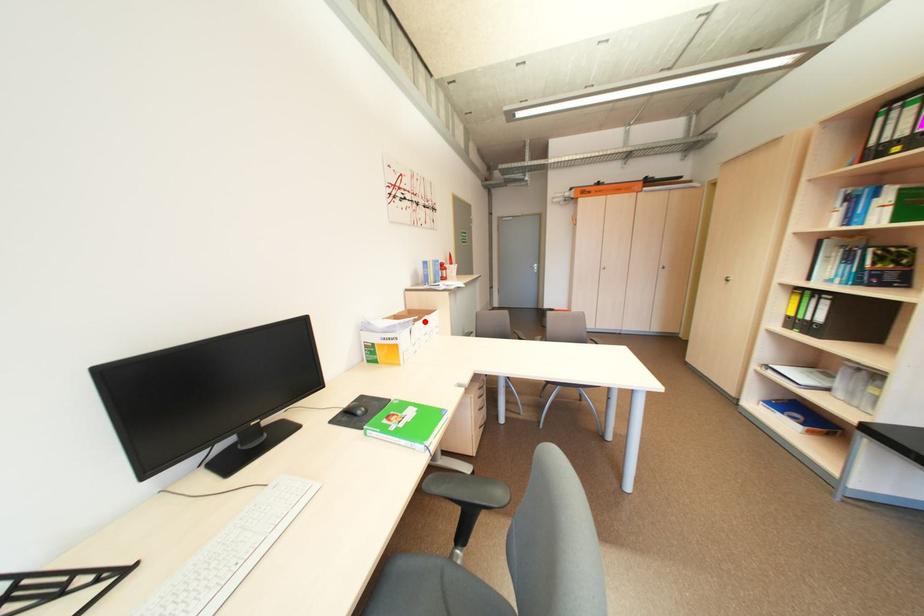
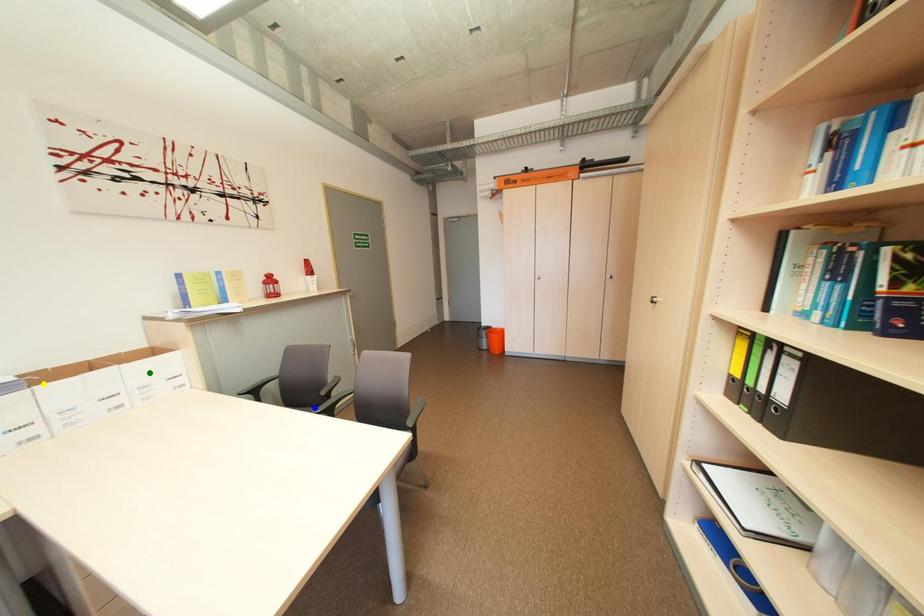
Question: I am providing you with two images of the same scene from different viewpoints. A red point is marked on the first image. You are given multiple points on the second image. Which spot in image 2 lines up with the point in image 1?

Choices:
 (A) green point
 (B) blue point
 (C) yellow point

Answer: (C)